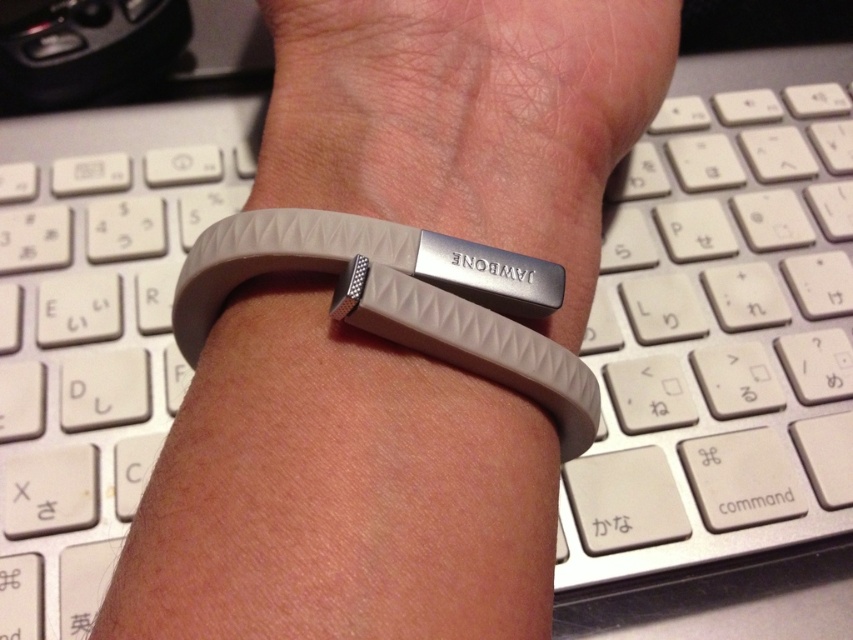
Question: Is matte gray wristband at center below gray rubber wristband at center?

Choices:
 (A) no
 (B) yes

Answer: (A)

Question: Which object is positioned farthest from the matte gray wristband at center?

Choices:
 (A) white plastic keyboard at center
 (B) gray rubber wristband at center

Answer: (A)

Question: Is matte gray wristband at center to the left of gray rubber wristband at center from the viewer's perspective?

Choices:
 (A) yes
 (B) no

Answer: (B)

Question: Which is farther from the white plastic keyboard at center?

Choices:
 (A) gray rubber wristband at center
 (B) matte gray wristband at center

Answer: (A)

Question: Which of the following is the closest to the observer?

Choices:
 (A) white plastic keyboard at center
 (B) gray rubber wristband at center

Answer: (B)

Question: Observing the image, what is the correct spatial positioning of white plastic keyboard at center in reference to gray rubber wristband at center?

Choices:
 (A) above
 (B) below

Answer: (A)